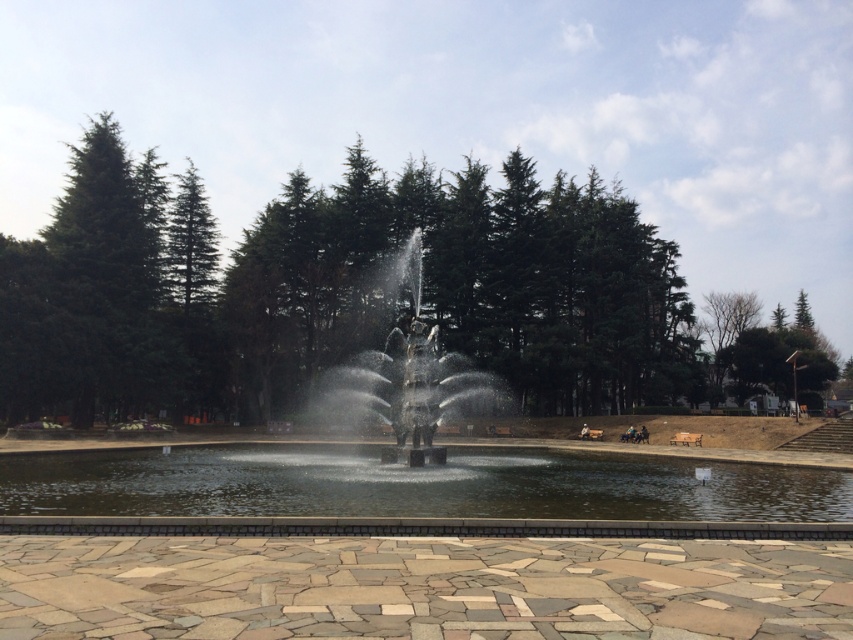
Which is in front, point (165, 316) or point (404, 388)?

Positioned in front is point (404, 388).

Is green textured trees at center bigger than polished bronze statue at center?

Correct, green textured trees at center is larger in size than polished bronze statue at center.

Where is `green textured trees at center`? green textured trees at center is located at coordinates (335, 291).

Identify the location of green textured trees at center. The width and height of the screenshot is (853, 640). 335,291.

Is clear water at center taller than polished bronze statue at center?

No.

Which is in front, point (467, 468) or point (329, 410)?

Positioned in front is point (467, 468).

Where is `clear water at center`? Image resolution: width=853 pixels, height=640 pixels. clear water at center is located at coordinates 415,484.

Does point (20, 385) lie behind point (821, 516)?

Yes, it is behind point (821, 516).

Which is more to the left, green textured trees at center or clear water at center?

clear water at center

Find the location of `green textured trees at center`. green textured trees at center is located at coordinates (335, 291).